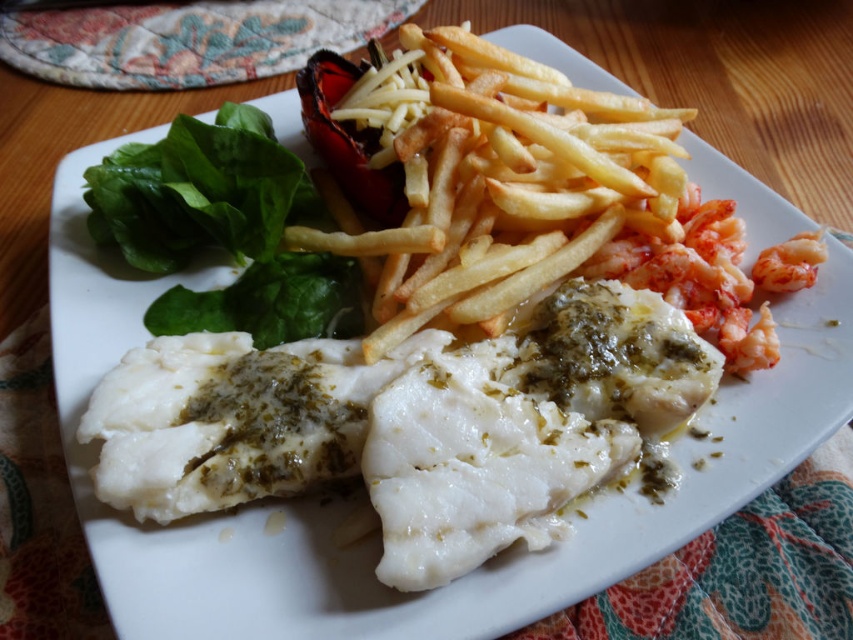
You are a food critic analyzing this meal. You notice the green leafy vegetable at upper left and the shiny pink shrimp at right. Which of these two items is positioned closer to the left edge of the plate?

The green leafy vegetable at upper left is positioned closer to the left edge of the plate than the shiny pink shrimp at right.

What is the 2D coordinate of the green leafy vegetable at upper left on the plate?

The green leafy vegetable at upper left is located at the 2D coordinate point of (x=223, y=228).

You are a food critic evaluating this meal. You need to describe the relative sizes of the green leafy vegetable at upper left and the shiny pink shrimp at right. Which one is bigger?

The green leafy vegetable at upper left is larger in size than the shiny pink shrimp at right.